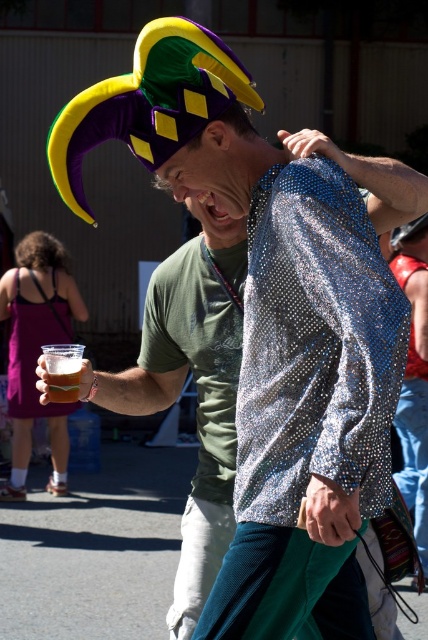
Is purple satin dress at lower left taller than translucent plastic cup at upper left?

Indeed, purple satin dress at lower left has a greater height compared to translucent plastic cup at upper left.

Does point (32, 333) come in front of point (44, 353)?

No, (32, 333) is behind (44, 353).

Is point (33, 364) positioned after point (59, 372)?

That is True.

Where is `purple satin dress at lower left`? The image size is (428, 640). purple satin dress at lower left is located at coordinates (33, 349).

Between purple satin dress at lower left and brown hair at upper left, which one has more height?

With more height is purple satin dress at lower left.

Can you confirm if purple satin dress at lower left is bigger than brown hair at upper left?

Correct, purple satin dress at lower left is larger in size than brown hair at upper left.

Measure the distance between point (29, 406) and camera.

The distance of point (29, 406) from camera is 28.26 feet.

Locate an element on the screen. purple satin dress at lower left is located at coordinates (33, 349).

In the scene shown: Is inflatable jester hat at upper left in front of brown hair at upper left?

→ Yes, inflatable jester hat at upper left is in front of brown hair at upper left.

Can you confirm if inflatable jester hat at upper left is positioned to the left of brown hair at upper left?

No, inflatable jester hat at upper left is not to the left of brown hair at upper left.

The image size is (428, 640). I want to click on inflatable jester hat at upper left, so click(149, 104).